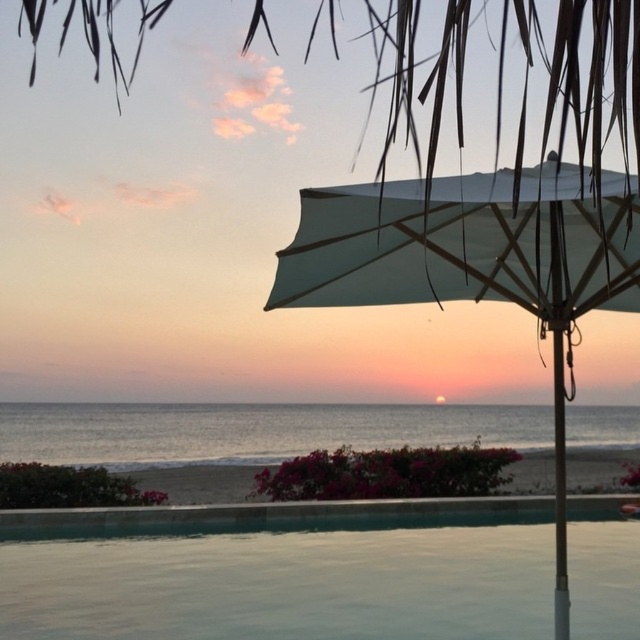
Looking at this image, is smooth glass pool at lower center in front of white fabric umbrella at right?

That is False.

Which of these two, smooth glass pool at lower center or white fabric umbrella at right, stands taller?

Standing taller between the two is white fabric umbrella at right.

The width and height of the screenshot is (640, 640). Identify the location of smooth glass pool at lower center. (284, 572).